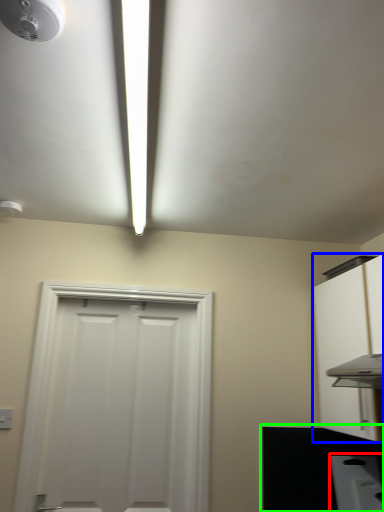
Question: Considering the real-world distances, which object is closest to appliance (highlighted by a red box)? cabinetry (highlighted by a blue box) or counter top (highlighted by a green box).

Choices:
 (A) cabinetry
 (B) counter top

Answer: (B)